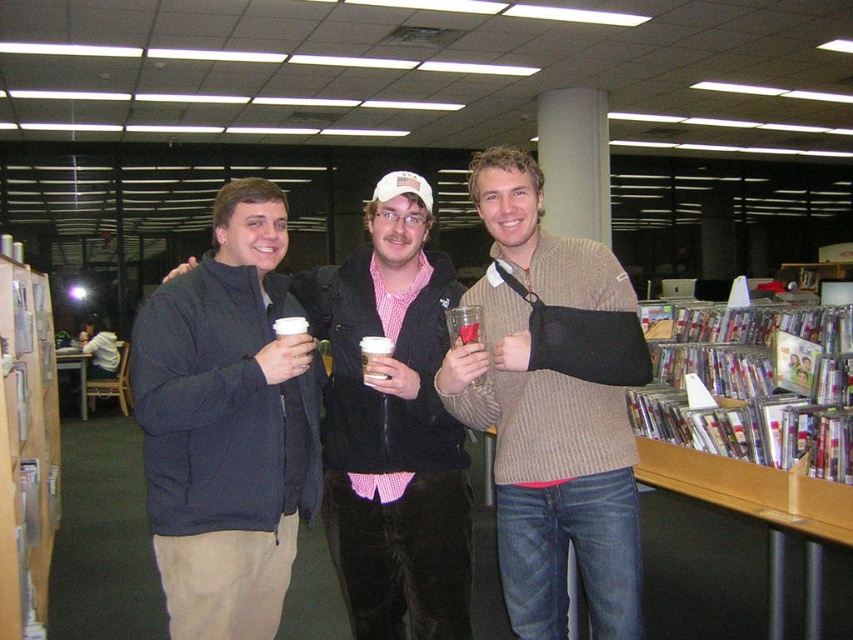
Based on the photo, you are trying to decide which item to place in a storage box that can only hold items narrower than 30 cm. You see the knit sweater at center and the dark blue jacket at center. Based on their widths, which item can fit into the box?

The knit sweater at center can fit into the storage box because its width is less than 30 cm, while the dark blue jacket at center is wider and cannot fit.